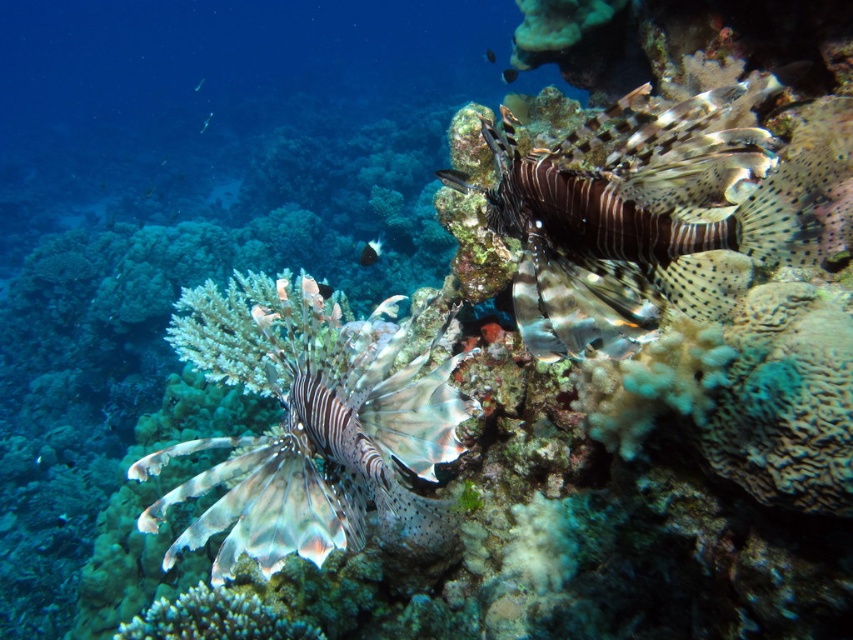
You are a marine biologist studying the coral reef. You notice a point marked at coordinates (508, 74). Based on the scene, can you identify which object this point is located on?

The point at coordinates (508, 74) is located on the translucent blue fish at upper center.

You are a marine biologist observing an underwater scene. You notice a smooth silver fish at center and a translucent blue fish at upper left. Which fish is wider?

The translucent blue fish at upper left is wider than the smooth silver fish at center.